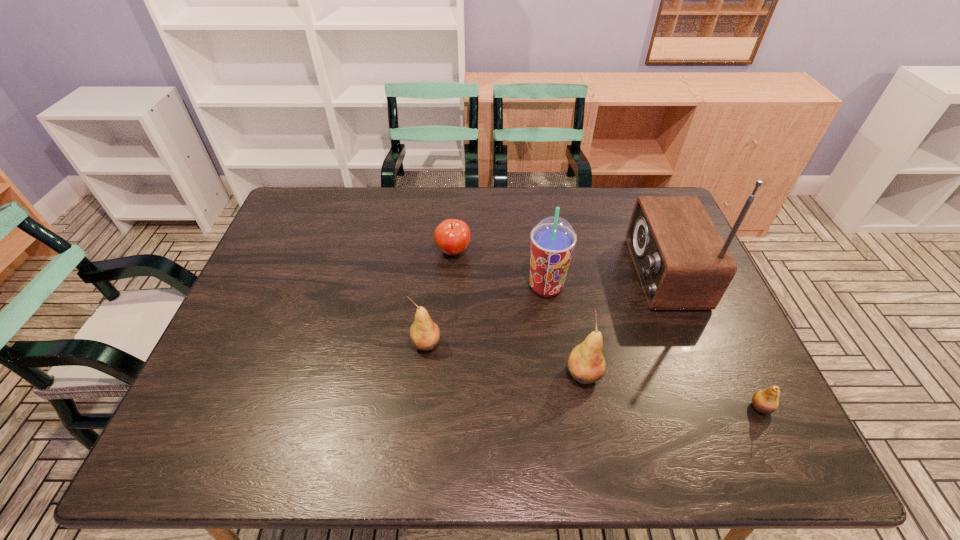
Find the location of a particular element. This screenshot has width=960, height=540. the leftmost pear is located at coordinates (424, 334).

I want to click on the fourth farthest object, so pos(424,334).

Identify the location of the second nearest pear. (586, 364).

The height and width of the screenshot is (540, 960). In order to click on the second pear from left to right in this screenshot , I will do `click(586, 364)`.

The image size is (960, 540). Find the location of `the rightmost pear`. the rightmost pear is located at coordinates (766, 401).

Locate an element on the screen. This screenshot has height=540, width=960. the nearest object is located at coordinates coord(766,401).

This screenshot has height=540, width=960. I want to click on radio receiver, so click(682, 262).

This screenshot has height=540, width=960. Find the location of `apple`. apple is located at coordinates (452, 236).

The width and height of the screenshot is (960, 540). Find the location of `the fifth shortest object`. the fifth shortest object is located at coordinates (553, 239).

Locate an element on the screen. The image size is (960, 540). vacant space positioned on the back of the leftmost pear is located at coordinates click(x=432, y=284).